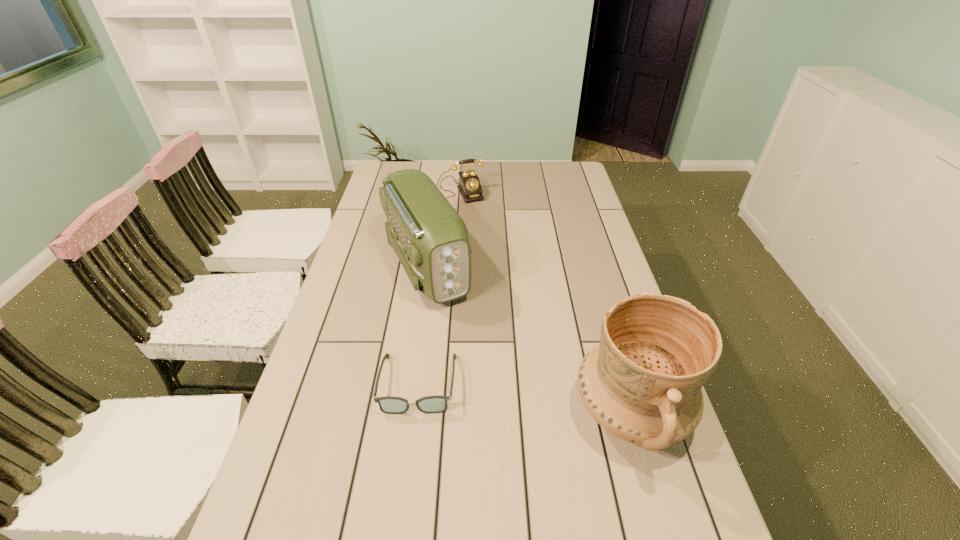
The width and height of the screenshot is (960, 540). In the image, there is a desktop. In order to click on vacant space at the right edge in this screenshot , I will do `click(564, 212)`.

The height and width of the screenshot is (540, 960). In the image, there is a desktop. What are the coordinates of `vacant space at the far left corner` in the screenshot? It's located at [x=406, y=166].

Where is `vacant space that is in between the shortest object and the second farthest object`? The image size is (960, 540). vacant space that is in between the shortest object and the second farthest object is located at coordinates (422, 325).

The height and width of the screenshot is (540, 960). Identify the location of vacant region between the spectacles and the third nearest object. (422, 325).

Locate an element on the screen. This screenshot has height=540, width=960. free spot between the pottery and the telephone is located at coordinates (538, 300).

The height and width of the screenshot is (540, 960). Find the location of `free point between the spectacles and the third nearest object`. free point between the spectacles and the third nearest object is located at coordinates (422, 325).

Locate an element on the screen. The height and width of the screenshot is (540, 960). free space that is in between the radio_receiver and the rightmost object is located at coordinates (528, 338).

Locate an element on the screen. The width and height of the screenshot is (960, 540). empty space that is in between the rightmost object and the telephone is located at coordinates (538, 300).

Where is `object that is the closest to the shortest object`? object that is the closest to the shortest object is located at coordinates (431, 240).

Locate an element on the screen. The height and width of the screenshot is (540, 960). object that stands as the closest to the rightmost object is located at coordinates (429, 404).